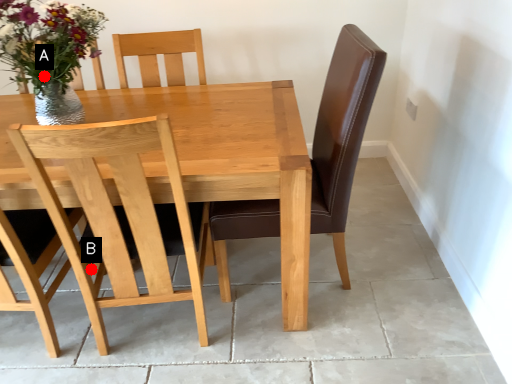
Question: Two points are circled on the image, labeled by A and B beside each circle. Which point is closer to the camera?

Choices:
 (A) A is closer
 (B) B is closer

Answer: (A)